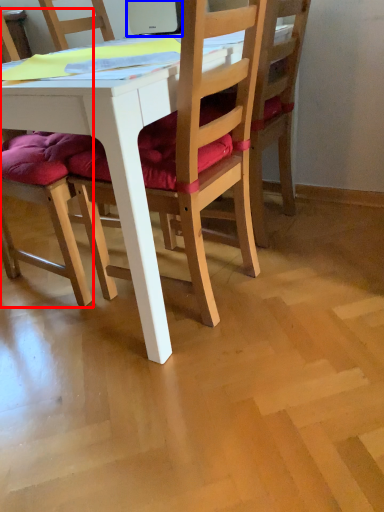
Question: Which object appears farthest to the camera in this image, chair (highlighted by a red box) or laptop (highlighted by a blue box)?

Choices:
 (A) chair
 (B) laptop

Answer: (B)